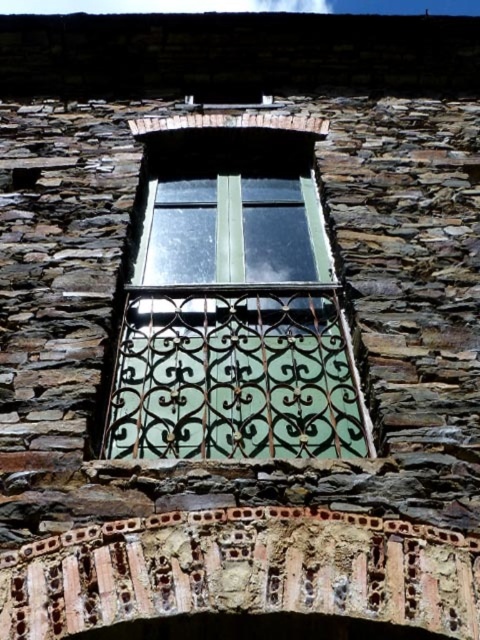
Is green matte glass window at center positioned before rusty metal balcony at center?

That is False.

Which is behind, point (119, 416) or point (271, 556)?

Positioned behind is point (119, 416).

The height and width of the screenshot is (640, 480). What do you see at coordinates (233, 301) in the screenshot?
I see `green matte glass window at center` at bounding box center [233, 301].

The width and height of the screenshot is (480, 640). I want to click on green matte glass window at center, so click(x=233, y=301).